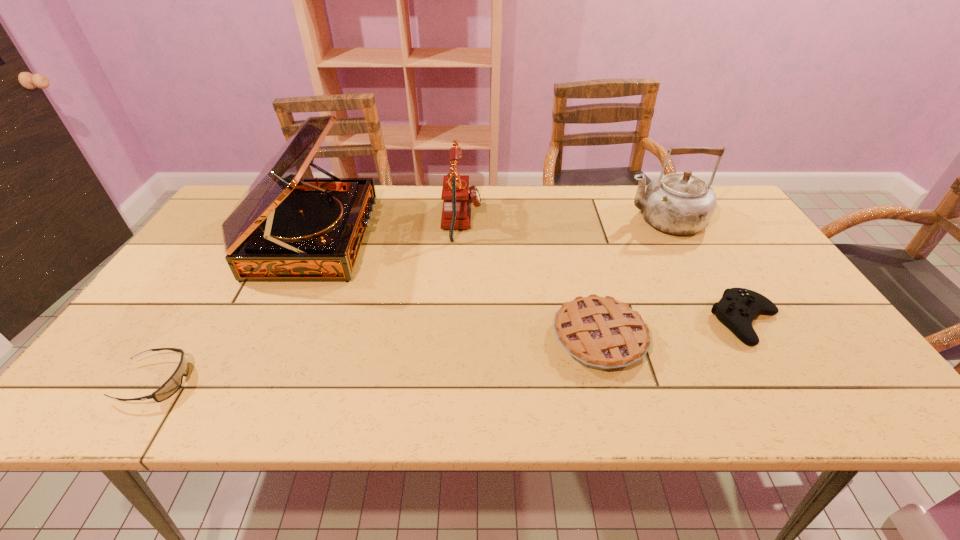
The height and width of the screenshot is (540, 960). Identify the location of blank area located 0.260m at the spout of the kettle. (540, 220).

This screenshot has height=540, width=960. What are the coordinates of `blank space located 0.310m on the dial of the third tallest object` in the screenshot? It's located at (583, 220).

Locate an element on the screen. The image size is (960, 540). free spot located on the back of the control is located at coordinates (679, 209).

I want to click on free point located on the back of the fourth object from left to right, so pyautogui.click(x=585, y=283).

Find the location of a particular element. Image resolution: width=960 pixels, height=540 pixels. free location located 0.180m on the lenses of the goggles is located at coordinates (275, 382).

At what (x,y) coordinates should I click in order to perform the action: click on record player present at the far edge. Please return your answer as a coordinate pair (x, y). This screenshot has width=960, height=540. Looking at the image, I should click on (284, 228).

At what (x,y) coordinates should I click in order to perform the action: click on kettle that is at the far edge. Please return your answer as a coordinate pair (x, y). Looking at the image, I should click on pyautogui.click(x=679, y=203).

At what (x,y) coordinates should I click in order to perform the action: click on telephone positioned at the far edge. Please return your answer as a coordinate pair (x, y). Image resolution: width=960 pixels, height=540 pixels. Looking at the image, I should click on (457, 196).

I want to click on pie that is at the near edge, so click(x=602, y=333).

Image resolution: width=960 pixels, height=540 pixels. Identify the location of goggles present at the near edge. (172, 385).